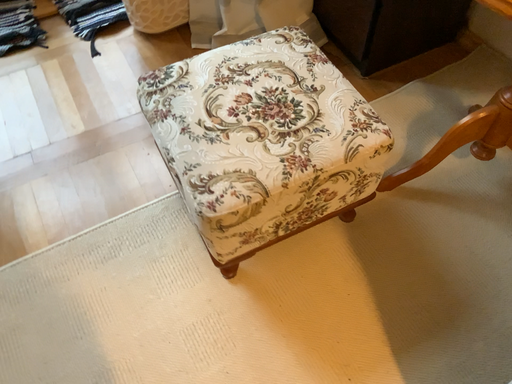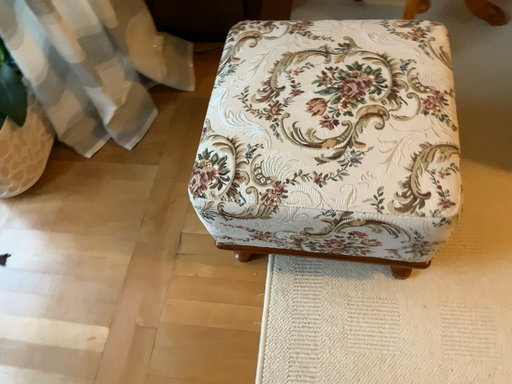
Question: Which way did the camera rotate in the video?

Choices:
 (A) rotated right
 (B) rotated left

Answer: (A)